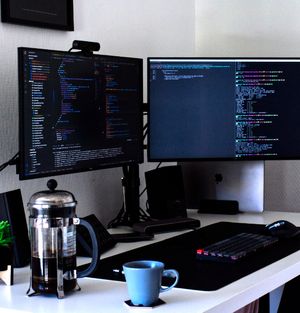
What are the coordinates of `webcam` in the screenshot? It's located at (87, 46).